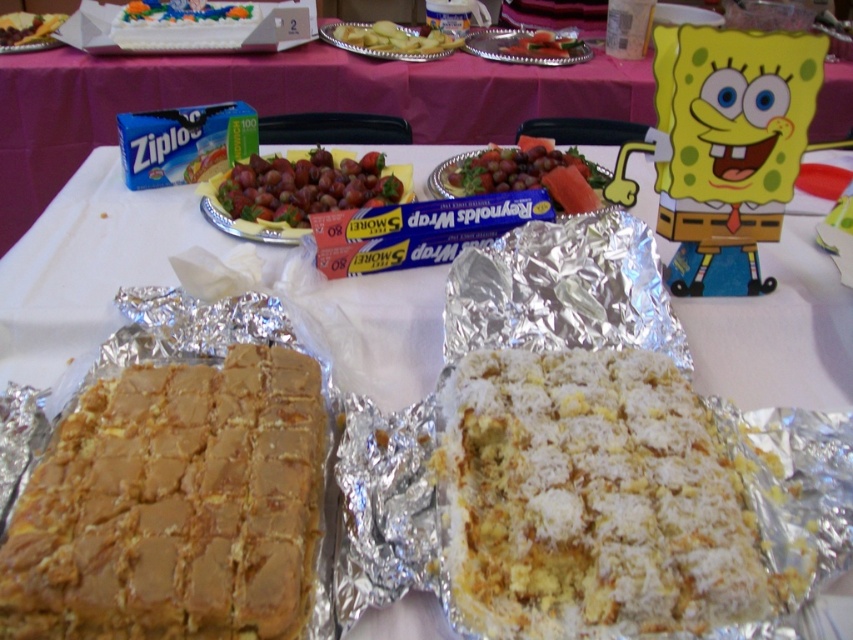
Is white crumbly cake at center bigger than smooth green cucumber at center?

Actually, white crumbly cake at center might be smaller than smooth green cucumber at center.

Who is lower down, white crumbly cake at center or smooth green cucumber at center?

white crumbly cake at center is lower down.

Image resolution: width=853 pixels, height=640 pixels. In order to click on white crumbly cake at center in this screenshot , I will do `click(593, 500)`.

Is fresh green grapes at center to the left of yellow cake at center from the viewer's perspective?

Incorrect, fresh green grapes at center is not on the left side of yellow cake at center.

At what (x,y) coordinates should I click in order to perform the action: click on fresh green grapes at center. Please return your answer as a coordinate pair (x, y). This screenshot has height=640, width=853. Looking at the image, I should click on (508, 170).

This screenshot has width=853, height=640. Identify the location of fresh green grapes at center. (508, 170).

Is fresh green grapes at center to the left of yellowish matte sliced potatoes at upper center from the viewer's perspective?

In fact, fresh green grapes at center is to the right of yellowish matte sliced potatoes at upper center.

Between point (474, 186) and point (428, 44), which one is positioned in front?

Point (474, 186) is more forward.

Find the location of a particular element. The image size is (853, 640). fresh green grapes at center is located at coordinates (508, 170).

This screenshot has height=640, width=853. Identify the location of fresh green grapes at center. (508, 170).